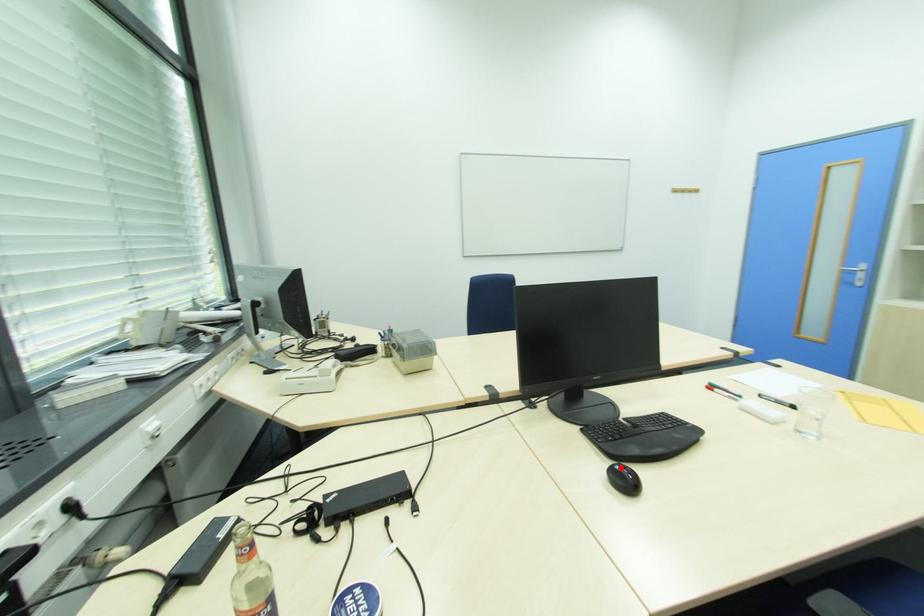
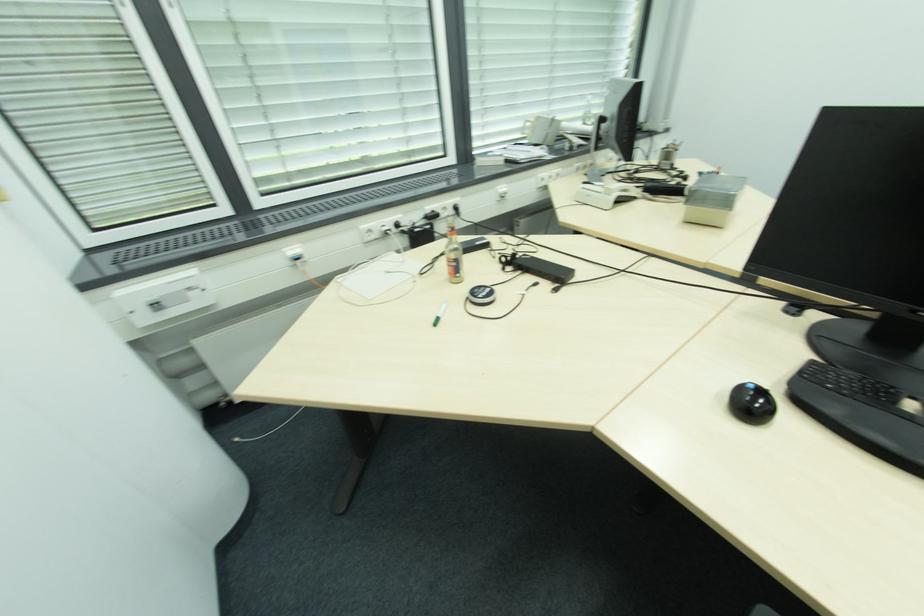
Where in the second image is the point corresponding to the highlighted location from the first image?

(755, 387)